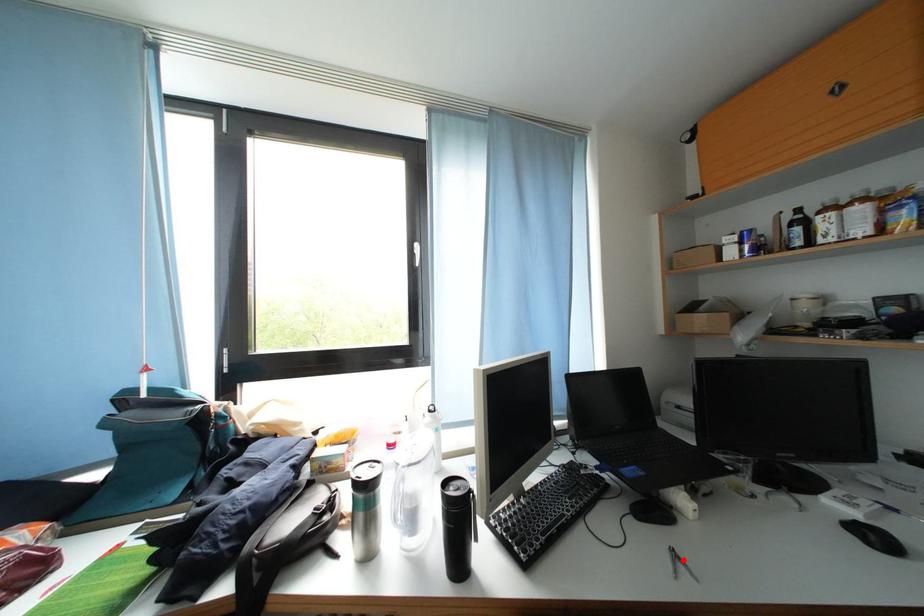
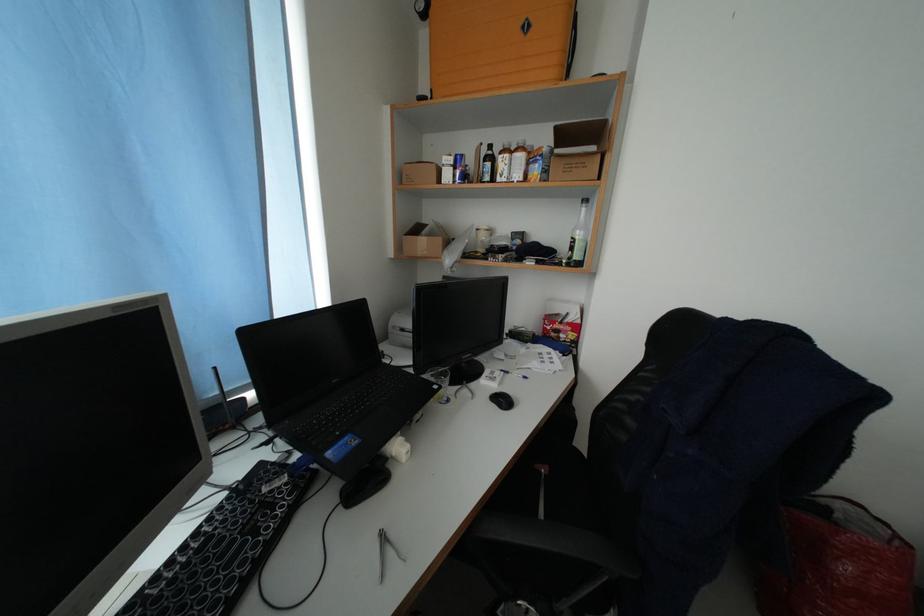
Find the pixel in the second image that matches the highlighted location in the first image.

(393, 543)